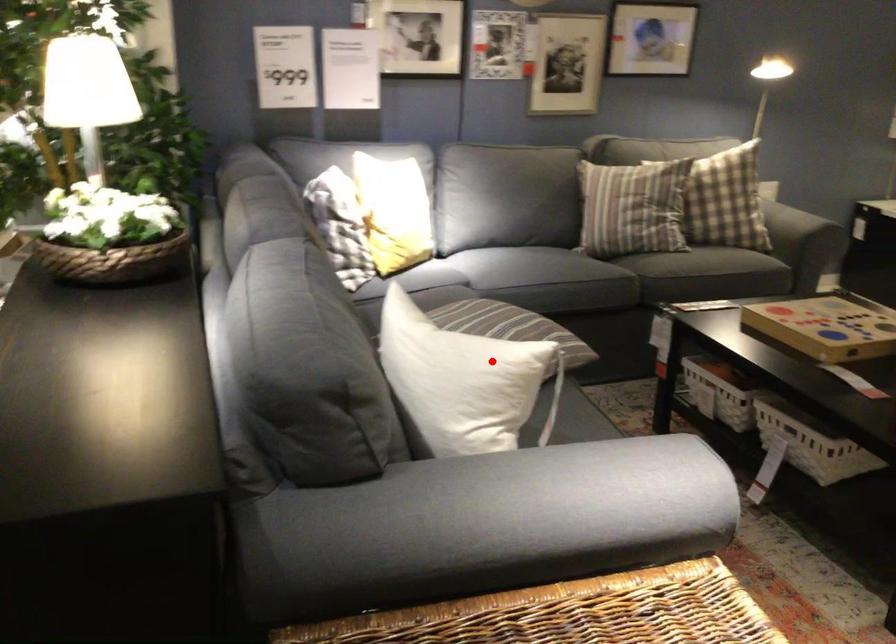
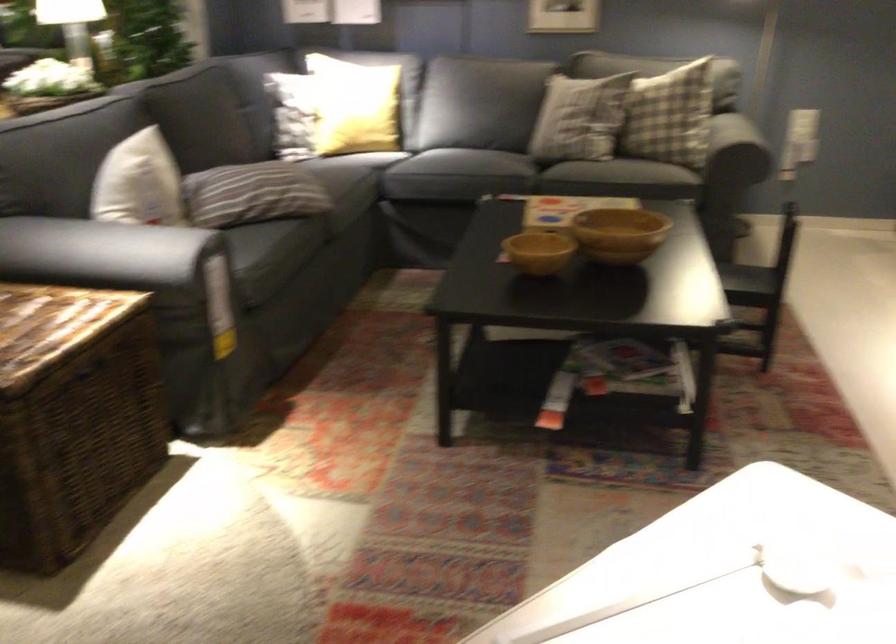
Find the pixel in the second image that matches the highlighted location in the first image.

(139, 183)